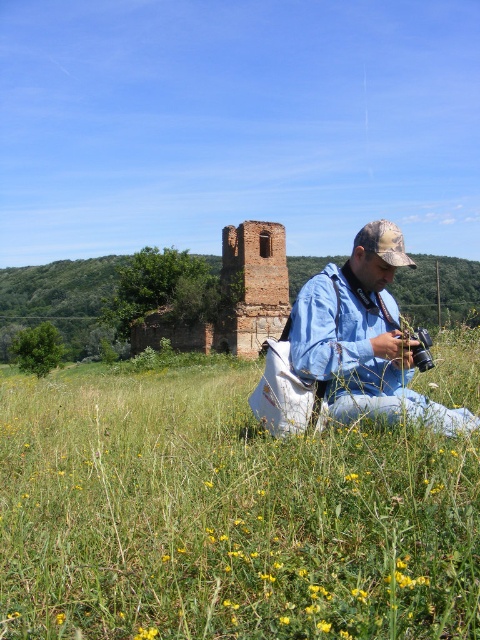
Which of these two, green grass at center or brown brick ruins at center, stands taller?

brown brick ruins at center

What do you see at coordinates (225, 516) in the screenshot? I see `green grass at center` at bounding box center [225, 516].

Between point (66, 588) and point (235, 237), which one is positioned in front?

Point (66, 588) is more forward.

Locate an element on the screen. The image size is (480, 640). green grass at center is located at coordinates (225, 516).

Is green grass at center shorter than blue denim jacket at center?

Yes.

Describe the element at coordinates (225, 516) in the screenshot. This screenshot has width=480, height=640. I see `green grass at center` at that location.

Identify the location of green grass at center. The height and width of the screenshot is (640, 480). (225, 516).

Can you confirm if blue denim jacket at center is wider than brown brick ruins at center?

In fact, blue denim jacket at center might be narrower than brown brick ruins at center.

Is blue denim jacket at center positioned in front of brown brick ruins at center?

That is True.

The height and width of the screenshot is (640, 480). What do you see at coordinates (363, 337) in the screenshot?
I see `blue denim jacket at center` at bounding box center [363, 337].

Where is `blue denim jacket at center`? blue denim jacket at center is located at coordinates (363, 337).